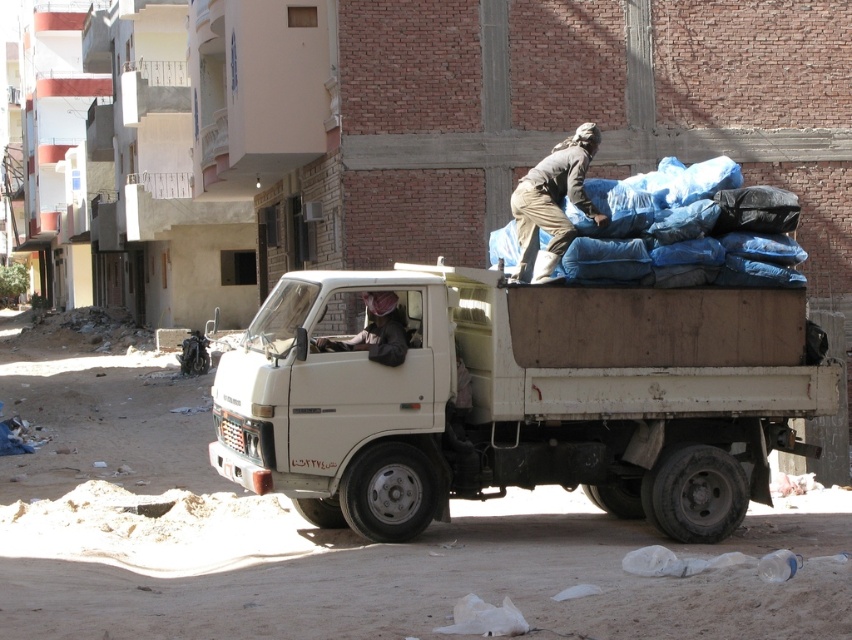
You are a delivery driver who needs to secure the load on your truck. You have a roll of straps. The blue tarpaulin bags at upper right are located at point (x=649, y=216). Where should you place the straps to secure the bags effectively?

The blue tarpaulin bags at upper right are located at point (x=649, y=216). To secure them effectively, place the straps around the bags at that point to ensure they stay in place during transport.

You are a delivery person who needs to secure the load on the truck bed. You see the blue tarpaulin bags at upper right and the dark brown fabric at upper right. Which item is positioned to the right side of the other?

The blue tarpaulin bags at upper right is to the right of dark brown fabric at upper right.

You are a delivery driver who needs to secure items on the truck bed. You see the dark brown fabric at upper right and the brown leather jacket at center. Which item is positioned higher up on the truck bed?

The dark brown fabric at upper right is located above the brown leather jacket at center, so it is positioned higher up on the truck bed.